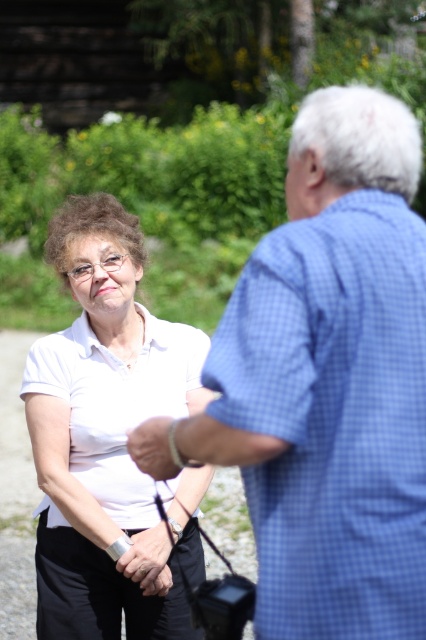
Question: Which point is closer to the camera taking this photo?

Choices:
 (A) (104, 225)
 (B) (155, 577)
 (C) (400, 282)

Answer: (C)

Question: Does blue checkered shirt at upper right have a lesser width compared to white matte shirt at center?

Choices:
 (A) no
 (B) yes

Answer: (B)

Question: Can you confirm if blue checkered shirt at upper right is thinner than matte black hand at center?

Choices:
 (A) no
 (B) yes

Answer: (A)

Question: Which point is farther from the camera taking this photo?

Choices:
 (A) (66, 477)
 (B) (155, 464)
 (C) (342, 273)
 (D) (150, 589)

Answer: (A)

Question: Which point is closer to the camera?

Choices:
 (A) white matte shirt at center
 (B) smooth skin hand at center

Answer: (B)

Question: Can you confirm if white matte shirt at center is wider than matte black hand at center?

Choices:
 (A) yes
 (B) no

Answer: (A)